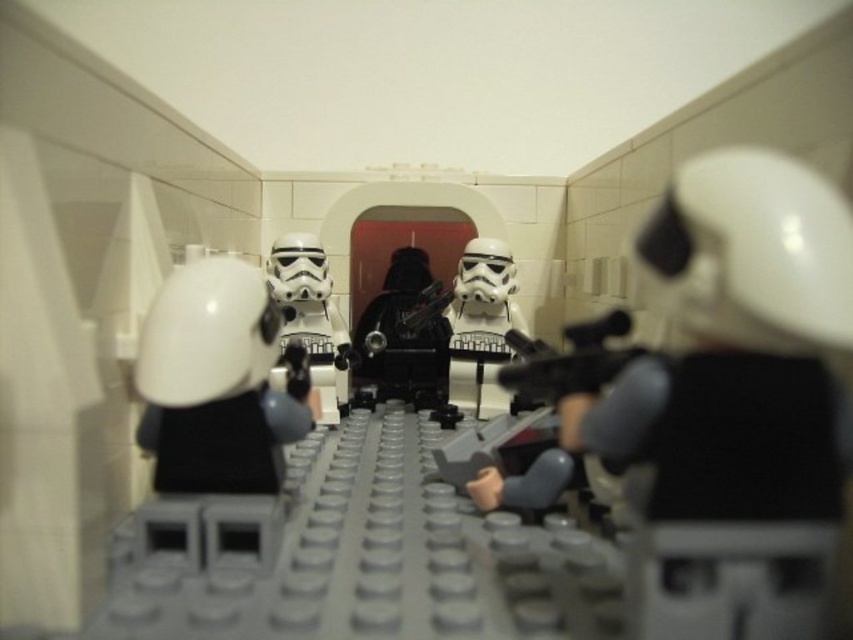
You are a small LEGO figure trying to move from the back of the white plastic stormtrooper at center to the front of the white glossy helmet at center. Is there enough space between them for you to pass through?

The white glossy helmet at center is in front of the white plastic stormtrooper at center, so there is space between them for you to pass through.

You are a small LEGO figure trying to move from the left side of the image to the right side. There is a black plastic gun at center and a white plastic stormtrooper at center in your path. Which object is blocking your path more directly?

The white plastic stormtrooper at center is behind the black plastic gun at center, so the black plastic gun at center is closer to your path and would block you more directly.